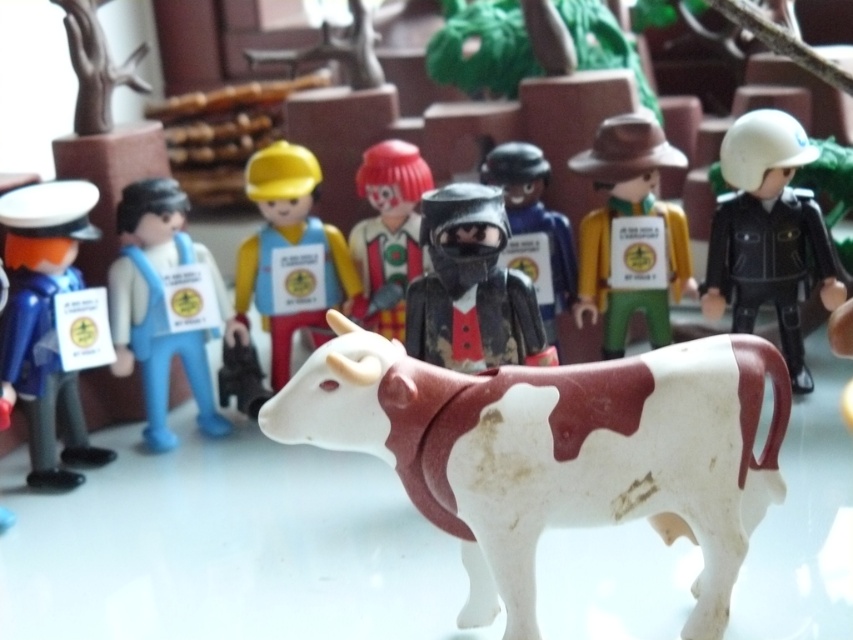
You are a child trying to reach the matte plastic clown at center from the white matte plastic bull at center. Which direction should you move to get closer to the clown?

The white matte plastic bull at center is in front of the matte plastic clown at center, so to reach the clown, you should move backward away from the bull.

You are setting up a display for a toy store and need to arrange the white matte plastic bull at center and the matte plastic clown at center on a shelf. The shelf has a width limit of 1 meter. If the bull is wider than the clown, will both fit side by side on the shelf?

The white matte plastic bull at center might be wider than the matte plastic clown at center. Since the shelf has a width limit of 1 meter, but we don not know the exact widths of both items, it is uncertain if they will fit side by side.

You are a toy collector examining the display of figurines. You notice a point marked at coordinates (471,288). Which object is located exactly at that point?

The point at coordinates (471,288) corresponds to the matte black knight helmet at center.